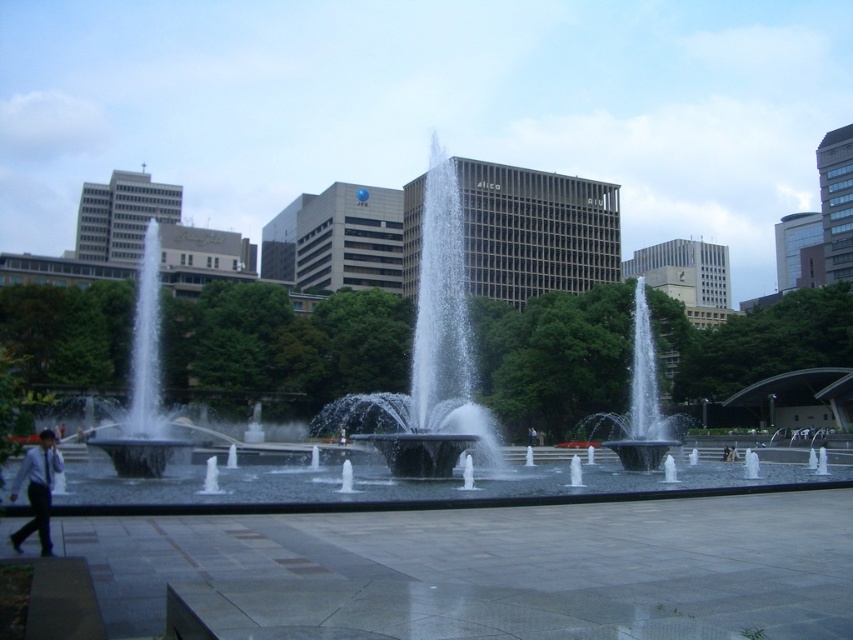
Does clear glass water at center left appear under black fabric person at center?

No.

Locate an element on the screen. clear glass water at center left is located at coordinates (143, 380).

The image size is (853, 640). In order to click on clear glass water at center left in this screenshot , I will do `click(143, 380)`.

Who is taller, black glossy fountain at center or black fabric person at center?

black glossy fountain at center is taller.

Does black glossy fountain at center have a larger size compared to black fabric person at center?

Yes, black glossy fountain at center is bigger than black fabric person at center.

This screenshot has height=640, width=853. I want to click on black glossy fountain at center, so click(436, 352).

Is dark gray suit at lower left smaller than black fabric person at center?

No.

Looking at this image, how far apart are dark gray suit at lower left and black fabric person at center?

They are 176.50 feet apart.

The image size is (853, 640). What are the coordinates of `dark gray suit at lower left` in the screenshot? It's located at (38, 490).

This screenshot has height=640, width=853. Identify the location of dark gray suit at lower left. (38, 490).